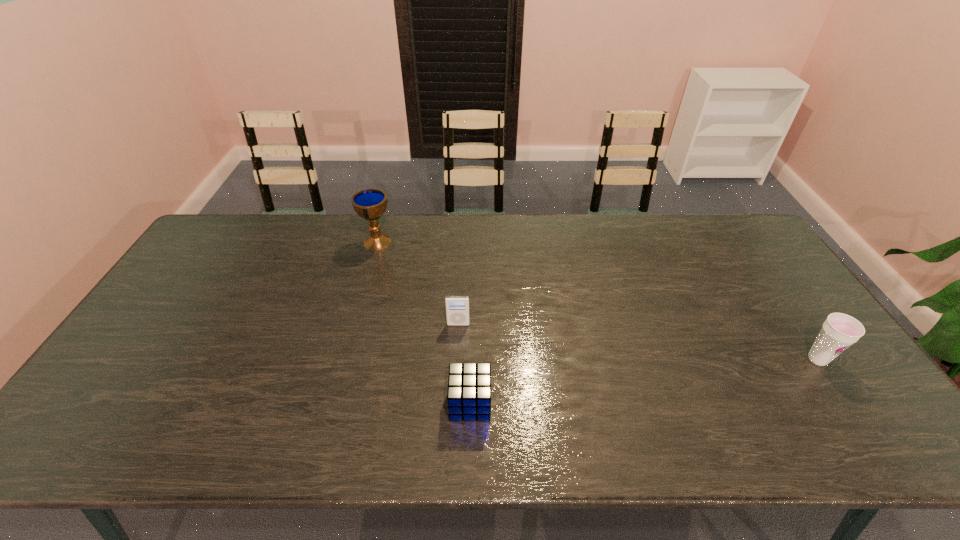
Locate an element on the screen. object that is at the far edge is located at coordinates pos(370,204).

This screenshot has width=960, height=540. What are the coordinates of `object that is at the near edge` in the screenshot? It's located at (469, 384).

You are a GUI agent. You are given a task and a screenshot of the screen. Output one action in this format:
    pyautogui.click(x=<x>, y=<y>)
    Task: Click on the object that is at the right edge
    
    Given the screenshot: What is the action you would take?
    pyautogui.click(x=839, y=331)

The image size is (960, 540). In the image, there is a desktop. What are the coordinates of `free space at the far edge` in the screenshot? It's located at (639, 239).

In the image, there is a desktop. At what (x,y) coordinates should I click in order to perform the action: click on vacant space at the near edge. Please return your answer as a coordinate pair (x, y). The width and height of the screenshot is (960, 540). Looking at the image, I should click on (538, 446).

Locate an element on the screen. free space at the left edge of the desktop is located at coordinates (148, 347).

In order to click on vacant area at the right edge of the desktop in this screenshot , I will do `click(789, 318)`.

This screenshot has width=960, height=540. I want to click on free region at the far right corner of the desktop, so click(716, 224).

Where is `unoccupied area between the cube and the chalice`? This screenshot has width=960, height=540. unoccupied area between the cube and the chalice is located at coordinates (423, 323).

The width and height of the screenshot is (960, 540). What are the coordinates of `vacant area that lies between the tallest object and the rightmost object` in the screenshot? It's located at (597, 301).